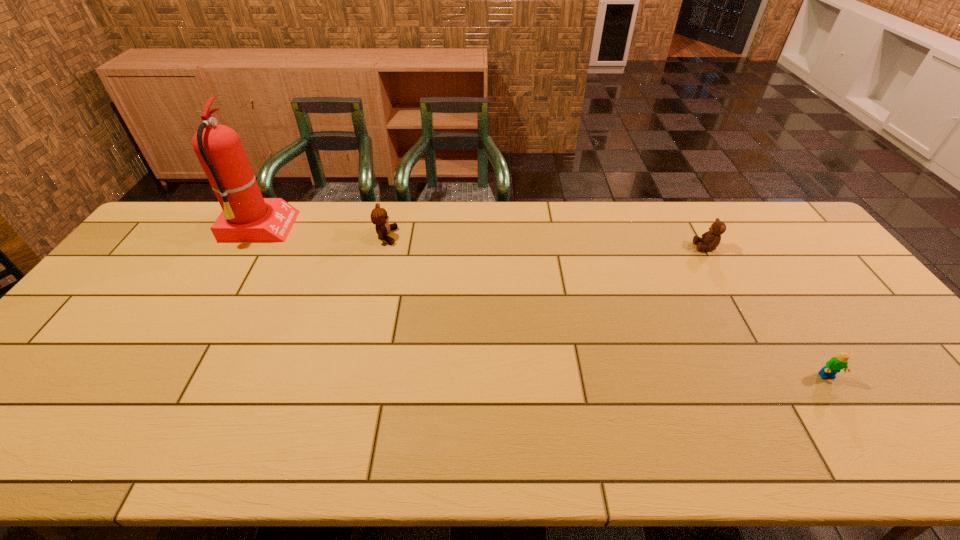
Choose which object is the second nearest neighbor to the third object from right to left. Please provide its 2D coordinates. Your answer should be formatted as a tuple, i.e. [(x, y)], where the tuple contains the x and y coordinates of a point satisfying the conditions above.

[(711, 239)]